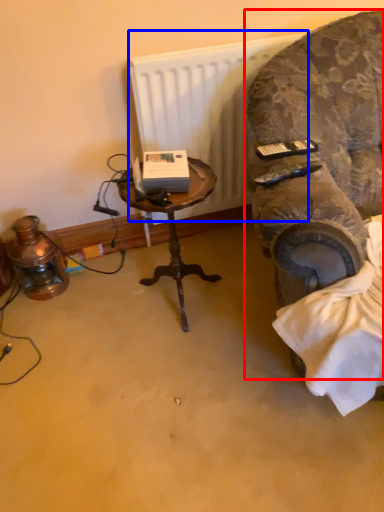
Question: Among these objects, which one is nearest to the camera, chair (highlighted by a red box) or radiator (highlighted by a blue box)?

Choices:
 (A) chair
 (B) radiator

Answer: (A)